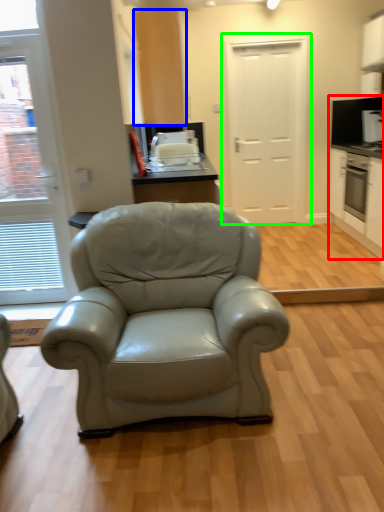
Question: Which object is positioned closest to cabinetry (highlighted by a red box)? Select from cabinetry (highlighted by a blue box) and door (highlighted by a green box).

Choices:
 (A) cabinetry
 (B) door

Answer: (B)